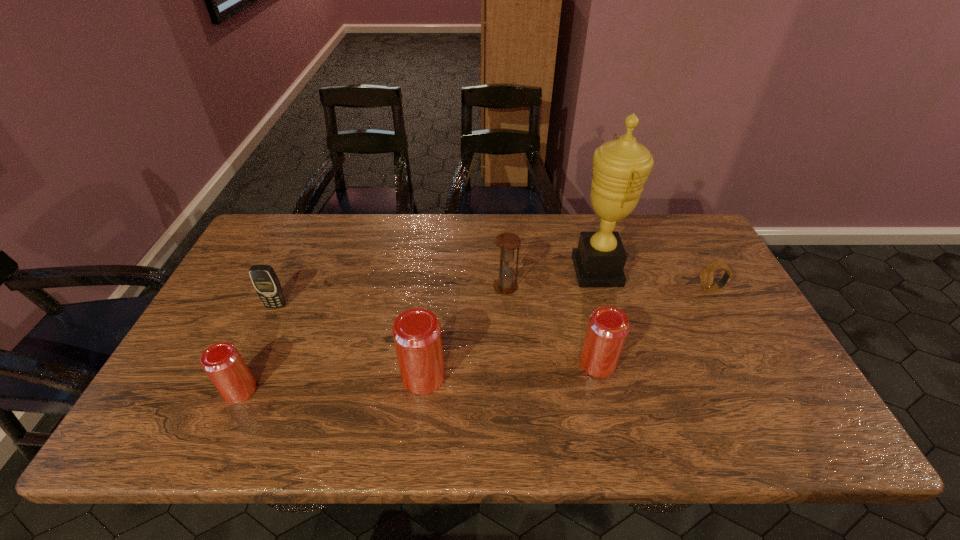
Where is `the shortest beer can`? the shortest beer can is located at coordinates coord(222,362).

Identify the location of the third object from left to right. (416, 332).

Image resolution: width=960 pixels, height=540 pixels. I want to click on the second shortest beer can, so click(607, 329).

In order to click on trophy cup in this screenshot , I will do `click(620, 167)`.

The image size is (960, 540). Find the location of `the fourth object from left to right`. the fourth object from left to right is located at coordinates (507, 242).

Identify the location of cellular telephone. (266, 283).

Identify the location of watch. The height and width of the screenshot is (540, 960). (706, 274).

At what (x,y) coordinates should I click in order to perform the action: click on the rightmost object. Please return your answer as a coordinate pair (x, y). Looking at the image, I should click on (706, 274).

Image resolution: width=960 pixels, height=540 pixels. Find the location of `free space located 0.150m on the right of the shortest beer can`. free space located 0.150m on the right of the shortest beer can is located at coordinates (321, 390).

Locate an element on the screen. This screenshot has width=960, height=540. free space located 0.220m on the left of the fifth object from right to left is located at coordinates (310, 376).